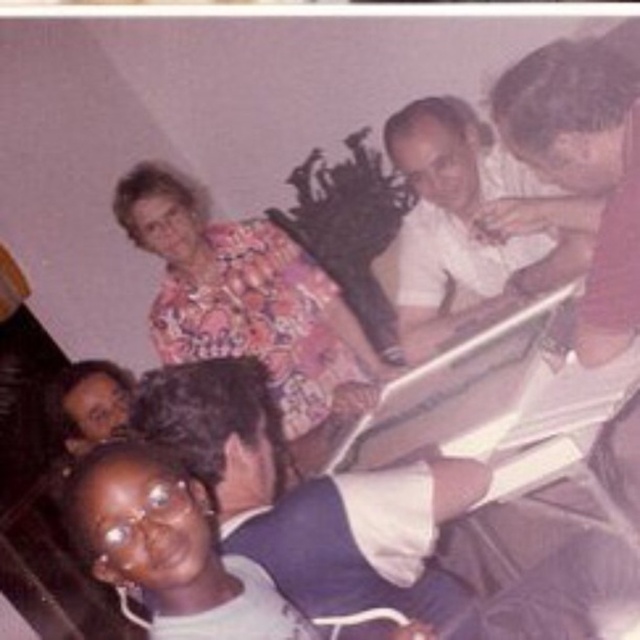
Image resolution: width=640 pixels, height=640 pixels. What do you see at coordinates (353, 518) in the screenshot?
I see `blue fabric shirt at lower left` at bounding box center [353, 518].

Can you confirm if blue fabric shirt at lower left is positioned to the right of matte white shirt at upper right?

No, blue fabric shirt at lower left is not to the right of matte white shirt at upper right.

Does point (586, 593) come closer to viewer compared to point (538, 289)?

Yes, it is in front of point (538, 289).

Identify the location of blue fabric shirt at lower left. The width and height of the screenshot is (640, 640). (353, 518).

Find the location of a particular element. This screenshot has height=640, width=640. floral fabric blouse at upper center is located at coordinates (243, 298).

Does floral fabric blouse at upper center appear over matte floral blouse at lower left?

Yes, floral fabric blouse at upper center is above matte floral blouse at lower left.

Find the location of `floral fabric blouse at upper center`. floral fabric blouse at upper center is located at coordinates (243, 298).

The image size is (640, 640). What do you see at coordinates (243, 298) in the screenshot? I see `floral fabric blouse at upper center` at bounding box center [243, 298].

Is floral fabric blouse at upper center wider than matte white shirt at upper right?

Correct, the width of floral fabric blouse at upper center exceeds that of matte white shirt at upper right.

Identify the location of floral fabric blouse at upper center. Image resolution: width=640 pixels, height=640 pixels. (243, 298).